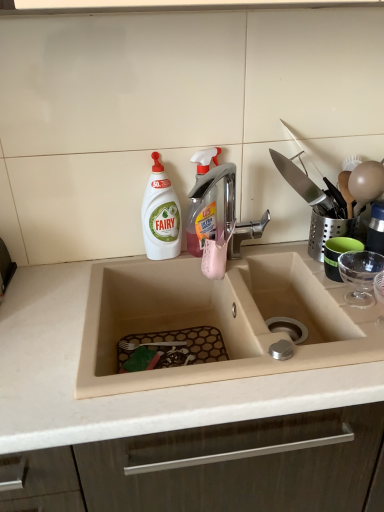
The height and width of the screenshot is (512, 384). I want to click on translucent plastic spray bottle at upper center, marked as the 2th cleaning product in a left-to-right arrangement, so click(202, 222).

Locate an element on the screen. Image resolution: width=384 pixels, height=512 pixels. translucent plastic spray bottle at upper center, marked as the 2th cleaning product in a left-to-right arrangement is located at coordinates (202, 222).

From a real-world perspective, which object rests below the other?

beige matte sink at center is physically lower.

Is beige matte sink at center not near white plastic bottle at upper left, positioned as the first cleaning product in left-to-right order?

beige matte sink at center is near white plastic bottle at upper left, positioned as the first cleaning product in left-to-right order, not far away.

The height and width of the screenshot is (512, 384). In the image, there is a white plastic bottle at upper left, which is counted as the second cleaning product, starting from the right. Identify the location of countertop below it (from a real-world perspective). (135, 391).

Is beige matte sink at center in front of or behind white plastic bottle at upper left, positioned as the first cleaning product in left-to-right order, in the image?

Clearly, beige matte sink at center is in front of white plastic bottle at upper left, positioned as the first cleaning product in left-to-right order.

From a real-world perspective, is beige matte sink at center below translucent plastic spray bottle at upper center, marked as the 2th cleaning product in a left-to-right arrangement?

Yes.

Would you say beige matte sink at center is inside or outside translucent plastic spray bottle at upper center, marked as the 2th cleaning product in a left-to-right arrangement?

The correct answer is: outside.

From the image's perspective, does beige matte sink at center appear lower than translucent plastic spray bottle at upper center, acting as the 1th cleaning product starting from the right?

Correct, beige matte sink at center appears lower than translucent plastic spray bottle at upper center, acting as the 1th cleaning product starting from the right, in the image.

Considering the sizes of white plastic bottle at upper left, positioned as the first cleaning product in left-to-right order, and beige matte sink at center in the image, is white plastic bottle at upper left, positioned as the first cleaning product in left-to-right order, taller or shorter than beige matte sink at center?

white plastic bottle at upper left, positioned as the first cleaning product in left-to-right order, is taller than beige matte sink at center.

Between white plastic bottle at upper left, which is counted as the second cleaning product, starting from the right, and beige matte sink at center, which one has larger size?

Bigger between the two is beige matte sink at center.

Locate an element on the screen. The width and height of the screenshot is (384, 512). countertop on the right of white plastic bottle at upper left, which is counted as the second cleaning product, starting from the right is located at coordinates (135, 391).

Considering the positions of point (167, 252) and point (196, 206), is point (167, 252) closer or farther from the camera than point (196, 206)?

Clearly, point (167, 252) is closer to the camera than point (196, 206).

From the image's perspective, between white plastic bottle at upper left, which is counted as the second cleaning product, starting from the right, and translucent plastic spray bottle at upper center, marked as the 2th cleaning product in a left-to-right arrangement, which one is located above?

From the image's view, translucent plastic spray bottle at upper center, marked as the 2th cleaning product in a left-to-right arrangement, is above.

Is white plastic bottle at upper left, which is counted as the second cleaning product, starting from the right, far from translucent plastic spray bottle at upper center, acting as the 1th cleaning product starting from the right?

That's not correct — white plastic bottle at upper left, which is counted as the second cleaning product, starting from the right, is a little close to translucent plastic spray bottle at upper center, acting as the 1th cleaning product starting from the right.

Does white plastic bottle at upper left, positioned as the first cleaning product in left-to-right order, contain translucent plastic spray bottle at upper center, acting as the 1th cleaning product starting from the right?

No, translucent plastic spray bottle at upper center, acting as the 1th cleaning product starting from the right, is not a part of white plastic bottle at upper left, positioned as the first cleaning product in left-to-right order.

In terms of width, does translucent plastic spray bottle at upper center, marked as the 2th cleaning product in a left-to-right arrangement, look wider or thinner when compared to white plastic bottle at upper left, positioned as the first cleaning product in left-to-right order?

Clearly, translucent plastic spray bottle at upper center, marked as the 2th cleaning product in a left-to-right arrangement, has less width compared to white plastic bottle at upper left, positioned as the first cleaning product in left-to-right order.

What's the angular difference between translucent plastic spray bottle at upper center, acting as the 1th cleaning product starting from the right, and white plastic bottle at upper left, positioned as the first cleaning product in left-to-right order,'s facing directions?

There is a 21.8-degree angle between the facing directions of translucent plastic spray bottle at upper center, acting as the 1th cleaning product starting from the right, and white plastic bottle at upper left, positioned as the first cleaning product in left-to-right order.

Does translucent plastic spray bottle at upper center, acting as the 1th cleaning product starting from the right, lie behind white plastic bottle at upper left, positioned as the first cleaning product in left-to-right order?

Yes, it is.

Is point (192, 156) closer or farther from the camera than point (134, 423)?

Clearly, point (192, 156) is more distant from the camera than point (134, 423).

From a real-world perspective, is translucent plastic spray bottle at upper center, marked as the 2th cleaning product in a left-to-right arrangement, physically above beige matte sink at center?

Yes, from a real-world perspective, translucent plastic spray bottle at upper center, marked as the 2th cleaning product in a left-to-right arrangement, is on top of beige matte sink at center.

Is translucent plastic spray bottle at upper center, acting as the 1th cleaning product starting from the right, bigger than beige matte sink at center?

No, translucent plastic spray bottle at upper center, acting as the 1th cleaning product starting from the right, is not bigger than beige matte sink at center.

I want to click on cleaning product that is the 1st one above the beige matte sink at center (from a real-world perspective), so click(161, 215).

Image resolution: width=384 pixels, height=512 pixels. What are the coordinates of `the 1st cleaning product to the left when counting from the beige matte sink at center` in the screenshot? It's located at [202, 222].

Based on their spatial positions, is white plastic bottle at upper left, which is counted as the second cleaning product, starting from the right, or beige matte sink at center further from translucent plastic spray bottle at upper center, marked as the 2th cleaning product in a left-to-right arrangement?

beige matte sink at center is further to translucent plastic spray bottle at upper center, marked as the 2th cleaning product in a left-to-right arrangement.

Based on their spatial positions, is white plastic bottle at upper left, positioned as the first cleaning product in left-to-right order, or translucent plastic spray bottle at upper center, marked as the 2th cleaning product in a left-to-right arrangement, closer to beige matte sink at center?

The object closer to beige matte sink at center is white plastic bottle at upper left, positioned as the first cleaning product in left-to-right order.

Based on their spatial positions, is beige matte sink at center or translucent plastic spray bottle at upper center, acting as the 1th cleaning product starting from the right, closer to white plastic bottle at upper left, positioned as the first cleaning product in left-to-right order?

translucent plastic spray bottle at upper center, acting as the 1th cleaning product starting from the right, lies closer to white plastic bottle at upper left, positioned as the first cleaning product in left-to-right order, than the other object.

From the image, which object appears to be nearer to beige matte sink at center, translucent plastic spray bottle at upper center, acting as the 1th cleaning product starting from the right, or white plastic bottle at upper left, which is counted as the second cleaning product, starting from the right?

white plastic bottle at upper left, which is counted as the second cleaning product, starting from the right, is positioned closer to the anchor beige matte sink at center.

Which object lies nearer to the anchor point translucent plastic spray bottle at upper center, acting as the 1th cleaning product starting from the right, beige matte sink at center or white plastic bottle at upper left, positioned as the first cleaning product in left-to-right order?

white plastic bottle at upper left, positioned as the first cleaning product in left-to-right order, lies closer to translucent plastic spray bottle at upper center, acting as the 1th cleaning product starting from the right, than the other object.

Considering their positions, is translucent plastic spray bottle at upper center, marked as the 2th cleaning product in a left-to-right arrangement, positioned further to white plastic bottle at upper left, positioned as the first cleaning product in left-to-right order, than beige matte sink at center?

beige matte sink at center is further to white plastic bottle at upper left, positioned as the first cleaning product in left-to-right order.

Locate an element on the screen. Image resolution: width=384 pixels, height=512 pixels. cleaning product between translucent plastic spray bottle at upper center, acting as the 1th cleaning product starting from the right, and beige matte sink at center vertically is located at coordinates (161, 215).